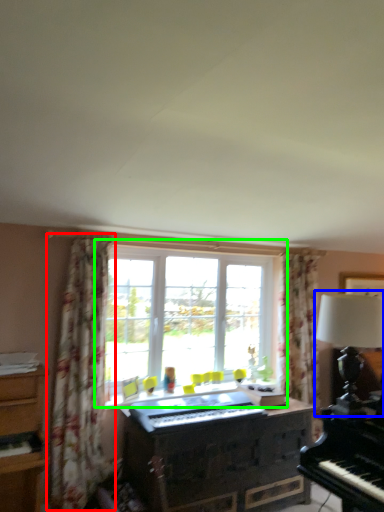
Question: Which object is positioned farthest from curtain (highlighted by a red box)? Select from table lamp (highlighted by a blue box) and window (highlighted by a green box).

Choices:
 (A) table lamp
 (B) window

Answer: (A)